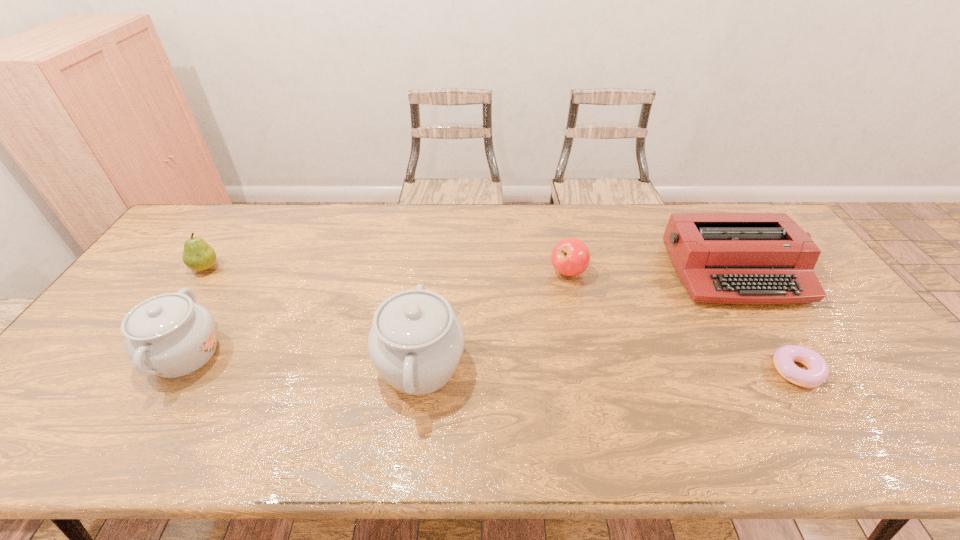
This screenshot has height=540, width=960. What are the coordinates of `the fifth shortest object` in the screenshot? It's located at (170, 335).

At what (x,y) coordinates should I click in order to perform the action: click on the shorter chinaware. Please return your answer as a coordinate pair (x, y). The image size is (960, 540). Looking at the image, I should click on (170, 335).

You are a GUI agent. You are given a task and a screenshot of the screen. Output one action in this format:
    pyautogui.click(x=<x>, y=<y>)
    Task: Click on the fourth object from right to left
    The width and height of the screenshot is (960, 540).
    Given the screenshot: What is the action you would take?
    pyautogui.click(x=416, y=342)

Locate an element on the screen. This screenshot has width=960, height=540. the taller chinaware is located at coordinates (416, 342).

Locate an element on the screen. The width and height of the screenshot is (960, 540). pear is located at coordinates (198, 255).

I want to click on typewriter, so 728,258.

Image resolution: width=960 pixels, height=540 pixels. Find the location of `the fourth object from left to right`. the fourth object from left to right is located at coordinates (570, 257).

Find the location of a particular element. the shortest object is located at coordinates (784, 357).

Locate an element on the screen. This screenshot has height=540, width=960. vacant space located on the left of the second tallest object is located at coordinates (86, 354).

I want to click on vacant space located 0.230m on the left of the right chinaware, so click(283, 365).